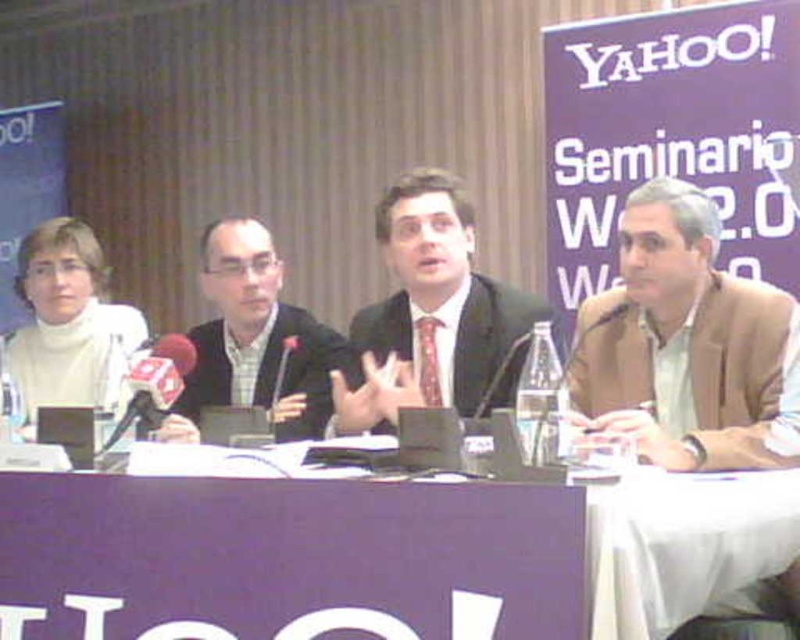
Which of these two, brown leather jacket at right or matte black suit at center, stands taller?

Standing taller between the two is matte black suit at center.

Does brown leather jacket at right appear under matte black suit at center?

Correct, brown leather jacket at right is located below matte black suit at center.

Who is more forward, (713, 224) or (452, 241)?

Point (713, 224)

Find the location of a particular element. brown leather jacket at right is located at coordinates (688, 346).

Between purple fabric table at center and metallic red microphone at left, which one appears on the right side from the viewer's perspective?

Positioned to the right is purple fabric table at center.

Between purple fabric table at center and metallic red microphone at left, which one has more height?

With more height is purple fabric table at center.

Measure the distance between purple fabric table at center and camera.

purple fabric table at center and camera are 1.19 meters apart from each other.

The image size is (800, 640). In order to click on purple fabric table at center in this screenshot , I will do `click(684, 545)`.

Which is more to the left, white matte sweater at left or metallic red microphone at left?

white matte sweater at left

Looking at this image, can you confirm if white matte sweater at left is smaller than metallic red microphone at left?

Actually, white matte sweater at left might be larger than metallic red microphone at left.

Between point (52, 323) and point (117, 429), which one is positioned in front?

Point (117, 429)

The image size is (800, 640). I want to click on white matte sweater at left, so tap(69, 324).